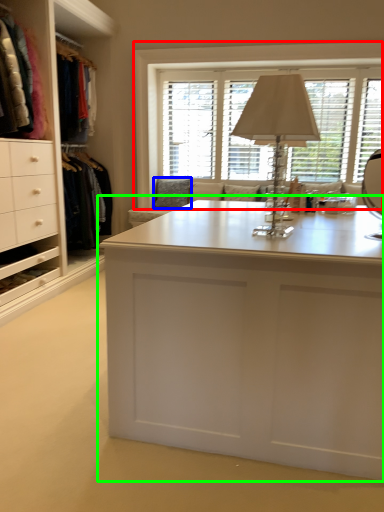
Question: Estimate the real-world distances between objects in this image. Which object is closer to window (highlighted by a red box), pillow (highlighted by a blue box) or desk (highlighted by a green box)?

Choices:
 (A) pillow
 (B) desk

Answer: (A)